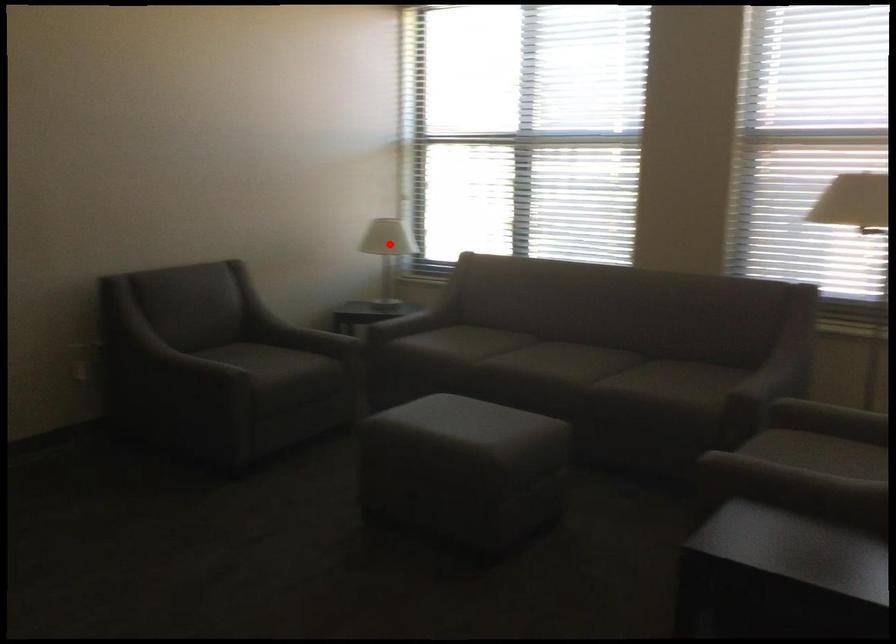
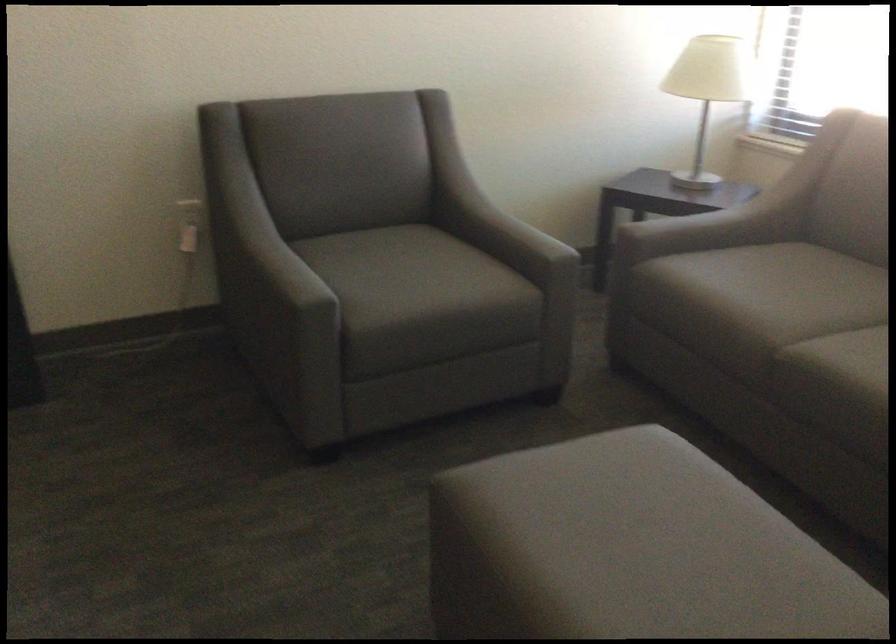
Question: I am providing you with two images of the same scene from different viewpoints. A red point is shown in image1. For the corresponding object point in image2, is it positioned nearer or farther from the camera?

Choices:
 (A) Nearer
 (B) Farther

Answer: (A)